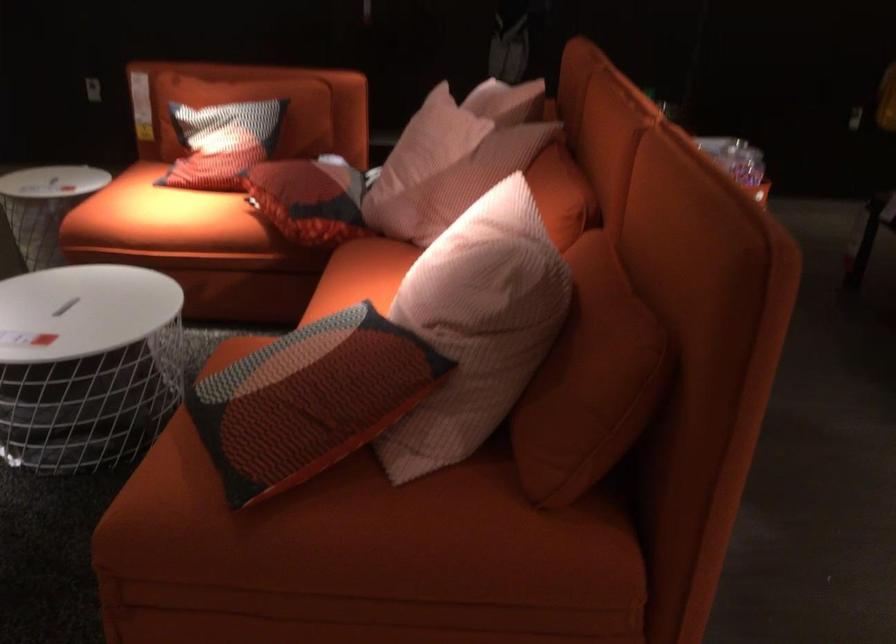
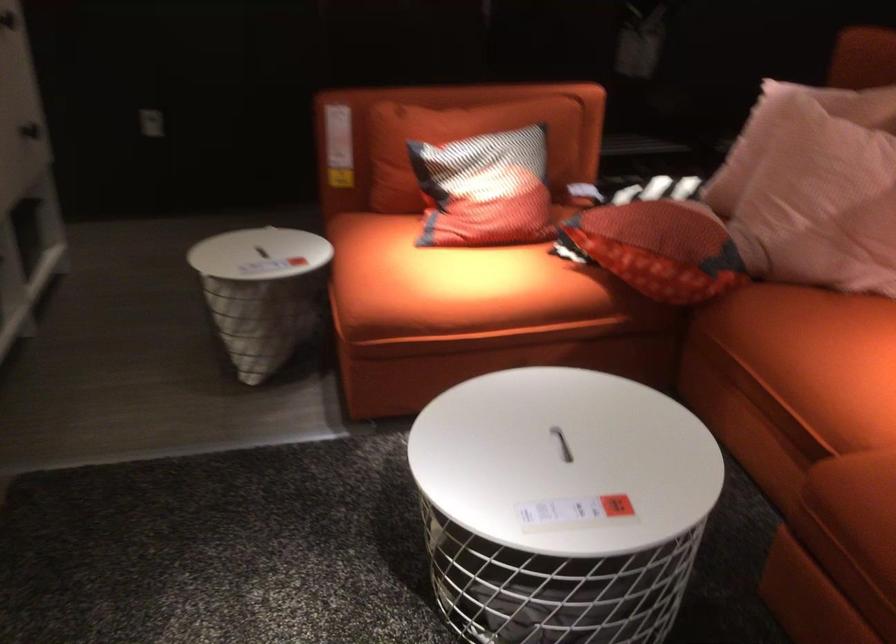
The point at (409, 178) is marked in the first image. Where is the corresponding point in the second image?

(823, 198)